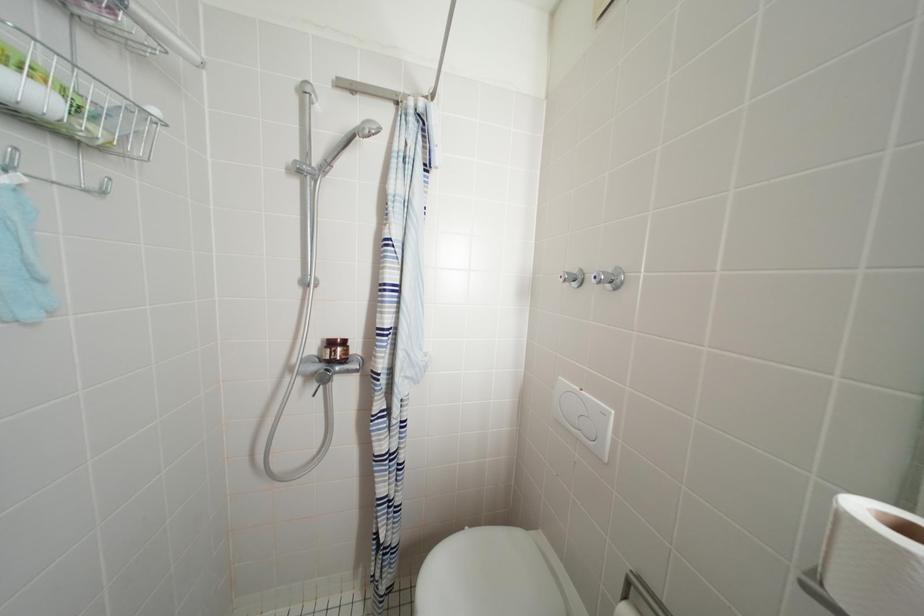
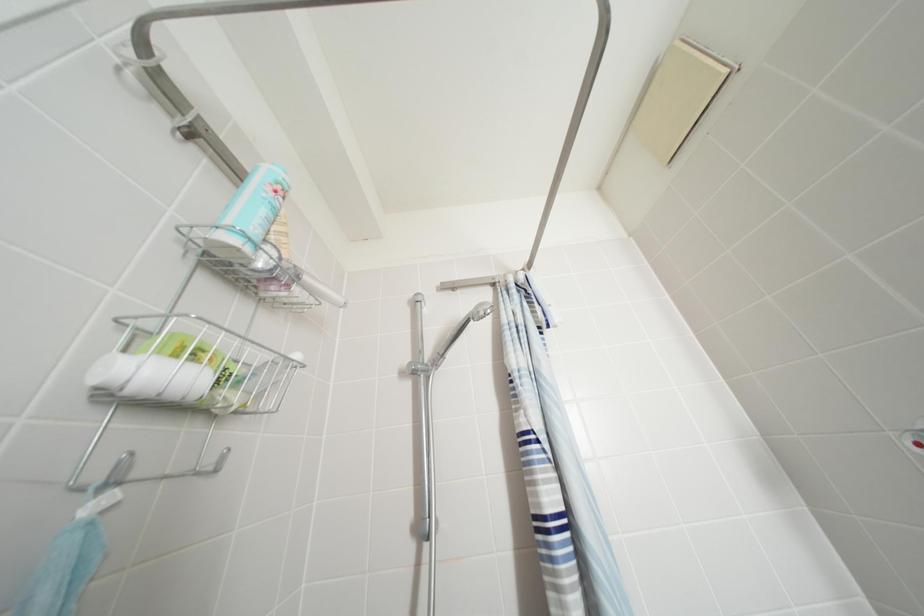
Question: How did the camera likely rotate?

Choices:
 (A) Left
 (B) Right
 (C) Up
 (D) Down

Answer: (C)